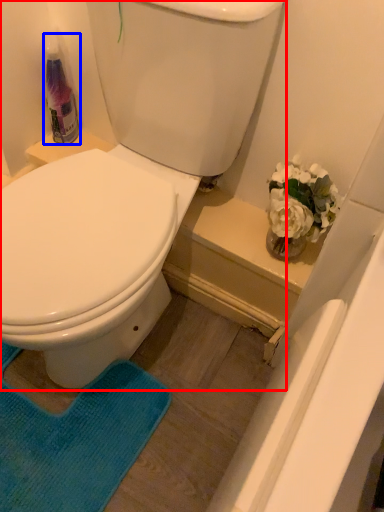
Question: Which of the following is the farthest to the observer, toilet (highlighted by a red box) or cleaning product (highlighted by a blue box)?

Choices:
 (A) toilet
 (B) cleaning product

Answer: (B)